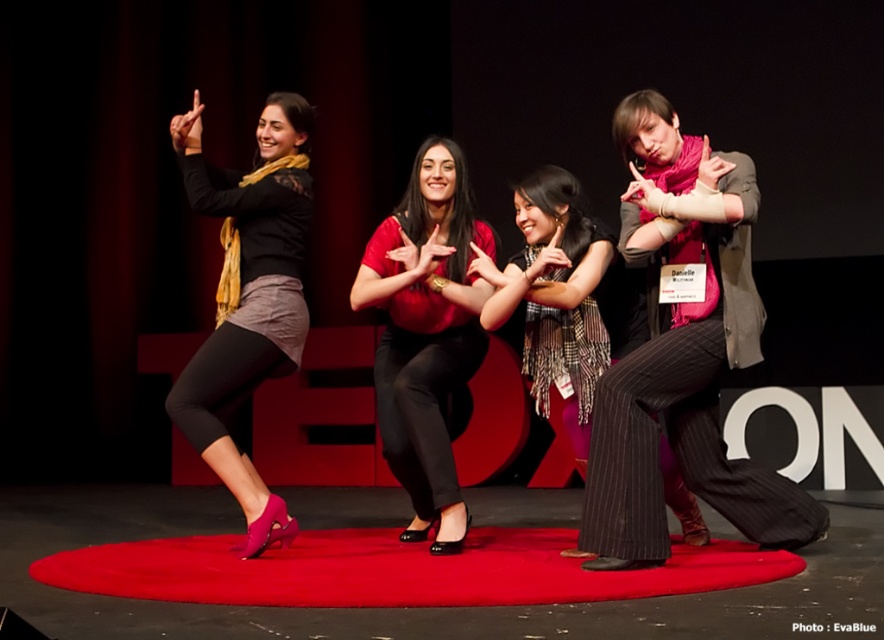
From the picture: Between rubberized red carpet at center and matte black skirt at left, which one is positioned higher?

matte black skirt at left

The image size is (884, 640). What are the coordinates of `rubberized red carpet at center` in the screenshot? It's located at (397, 570).

The image size is (884, 640). Identify the location of rubberized red carpet at center. [397, 570].

Locate an element on the screen. rubberized red carpet at center is located at coordinates [397, 570].

Is matte black skirt at left to the left of plaid scarf at center from the viewer's perspective?

Indeed, matte black skirt at left is positioned on the left side of plaid scarf at center.

Does matte black skirt at left appear over plaid scarf at center?

Yes.

Which is behind, point (292, 268) or point (523, 284)?

The point (292, 268) is more distant.

Find the location of a particular element. Image resolution: width=884 pixels, height=640 pixels. matte black skirt at left is located at coordinates (248, 296).

How distant is matte red blouse at center from plaid scarf at center?

The distance of matte red blouse at center from plaid scarf at center is 15.67 inches.

Is point (466, 268) farther from viewer compared to point (551, 380)?

No.

Locate an element on the screen. This screenshot has width=884, height=640. matte red blouse at center is located at coordinates (425, 332).